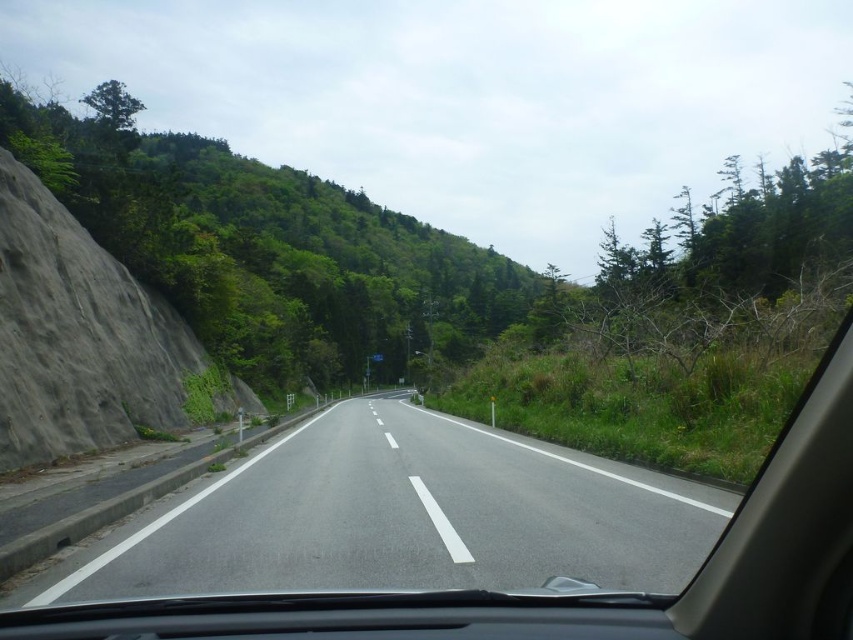
Is asphalt road at center thinner than green leafy tree at left?

Indeed, asphalt road at center has a lesser width compared to green leafy tree at left.

What do you see at coordinates (397, 516) in the screenshot? This screenshot has width=853, height=640. I see `asphalt road at center` at bounding box center [397, 516].

Does point (386, 486) lie behind point (115, 218)?

No, (386, 486) is in front of (115, 218).

Identify the location of asphalt road at center. Image resolution: width=853 pixels, height=640 pixels. (397, 516).

Does green leafy tree at left have a larger size compared to gray rough rock at left?

Yes, green leafy tree at left is bigger than gray rough rock at left.

This screenshot has height=640, width=853. Describe the element at coordinates (271, 248) in the screenshot. I see `green leafy tree at left` at that location.

At what (x,y) coordinates should I click in order to perform the action: click on green leafy tree at left. Please return your answer as a coordinate pair (x, y). The image size is (853, 640). Looking at the image, I should click on (271, 248).

Locate an element on the screen. This screenshot has height=640, width=853. asphalt road at center is located at coordinates (397, 516).

Which of these two, asphalt road at center or gray rough rock at left, stands shorter?

Standing shorter between the two is asphalt road at center.

Describe the element at coordinates (397, 516) in the screenshot. I see `asphalt road at center` at that location.

Where is `asphalt road at center`? asphalt road at center is located at coordinates (397, 516).